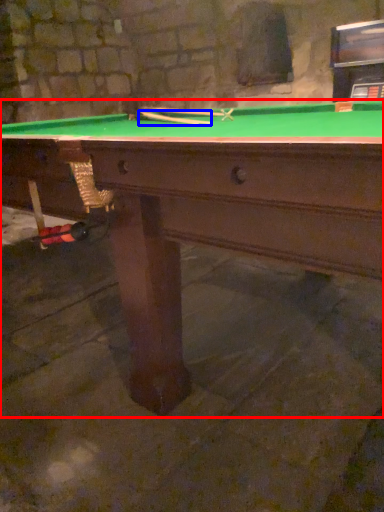
Question: Which object appears farthest to the camera in this image, billiard table (highlighted by a red box) or cue (highlighted by a blue box)?

Choices:
 (A) billiard table
 (B) cue

Answer: (B)